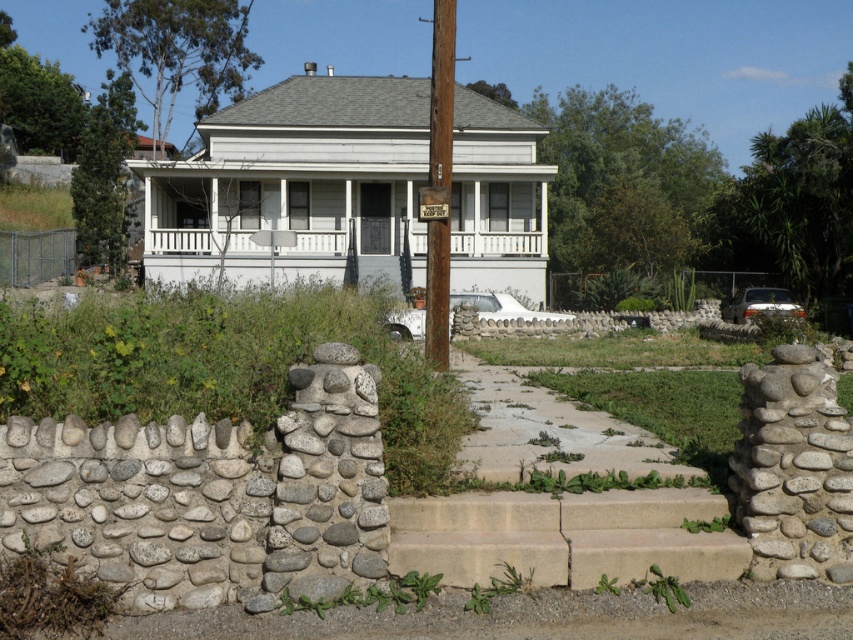
Which of these two, white painted wood porch at center or silver metallic sedan at right, stands shorter?

With less height is white painted wood porch at center.

Can you confirm if white painted wood porch at center is bigger than silver metallic sedan at right?

Actually, white painted wood porch at center might be smaller than silver metallic sedan at right.

Is point (178, 241) positioned before point (764, 289)?

That is True.

Identify the location of white painted wood porch at center. This screenshot has height=640, width=853. (498, 243).

Which of these two, white matte truck at center or silver metallic sedan at right, stands shorter?

With less height is white matte truck at center.

Between point (494, 292) and point (743, 296), which one is positioned behind?

The point (743, 296) is more distant.

Where is `white matte truck at center`? This screenshot has width=853, height=640. white matte truck at center is located at coordinates (502, 307).

Is brown wooden telegraph pole at center in front of white matte truck at center?

Yes, it is in front of white matte truck at center.

Does brown wooden telegraph pole at center appear under white matte truck at center?

No.

This screenshot has width=853, height=640. What are the coordinates of `brown wooden telegraph pole at center` in the screenshot? It's located at (440, 92).